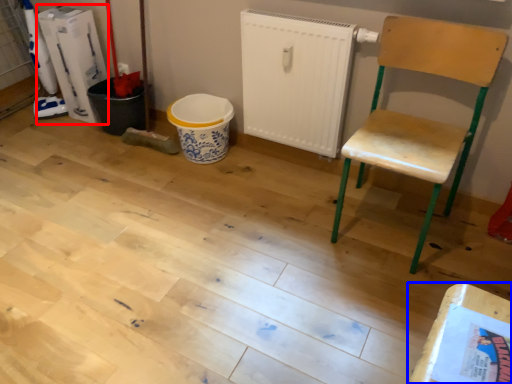
Question: Which object is closer to the camera taking this photo, appliance (highlighted by a red box) or table (highlighted by a blue box)?

Choices:
 (A) appliance
 (B) table

Answer: (B)